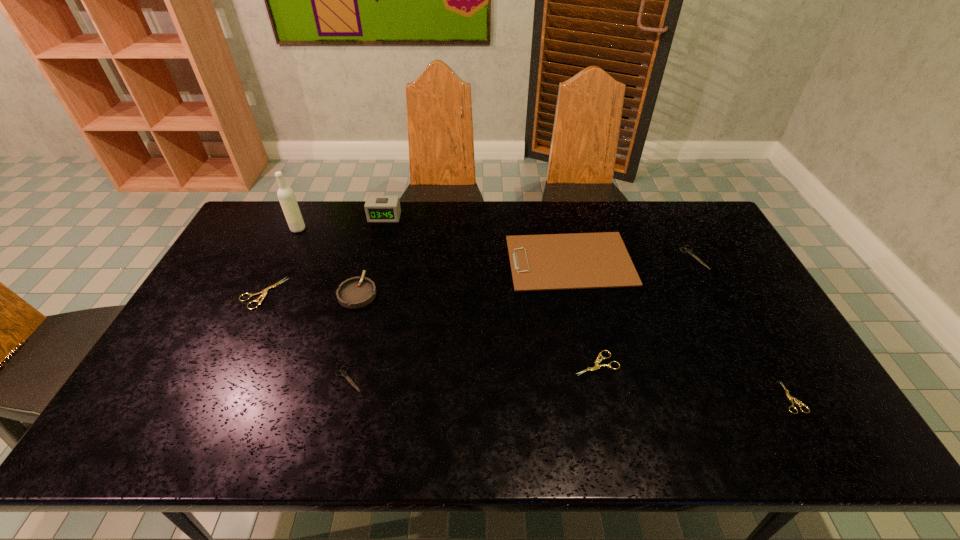
Image resolution: width=960 pixels, height=540 pixels. Find the location of `object at the near edge`. object at the near edge is located at coordinates [x=790, y=398].

The height and width of the screenshot is (540, 960). What are the coordinates of `object located at the left edge` in the screenshot? It's located at 264,293.

Locate an element on the screen. object present at the near right corner is located at coordinates (790, 398).

At what (x,y) coordinates should I click in order to perform the action: click on free space at the far edge of the desktop. Please return your answer as a coordinate pair (x, y). The image size is (960, 540). Looking at the image, I should click on (437, 234).

Locate an element on the screen. vacant area at the near edge of the desktop is located at coordinates (461, 428).

Where is `vacant area at the left edge of the desktop`? Image resolution: width=960 pixels, height=540 pixels. vacant area at the left edge of the desktop is located at coordinates (252, 252).

Image resolution: width=960 pixels, height=540 pixels. Identify the location of free spot at the right edge of the desktop. (763, 390).

Identify the location of free location at the far left corner of the desktop. (274, 227).

Identify the location of vacant space at the far right corner. (679, 212).

Identify the location of free point between the sixth shortest object and the fourth shears from right to left. (459, 319).